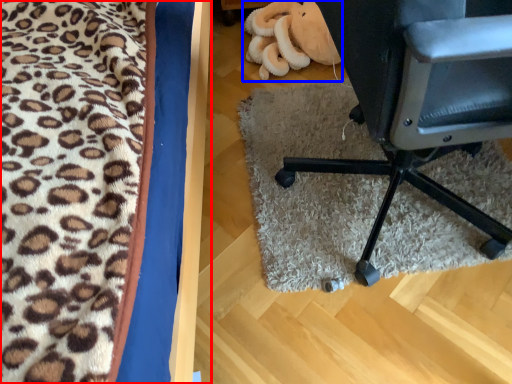
Question: Among these objects, which one is nearest to the camera, furniture (highlighted by a red box) or stuff (highlighted by a blue box)?

Choices:
 (A) furniture
 (B) stuff

Answer: (A)